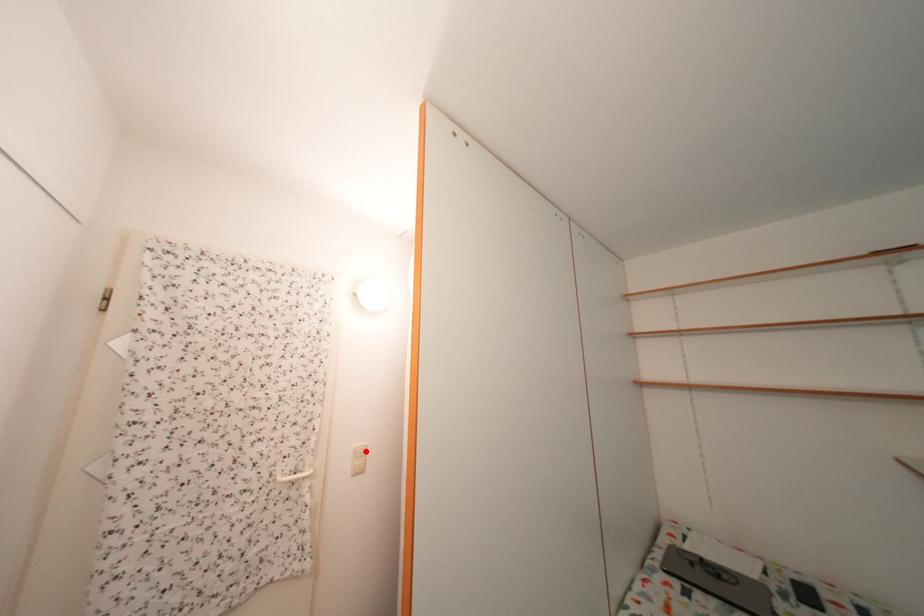
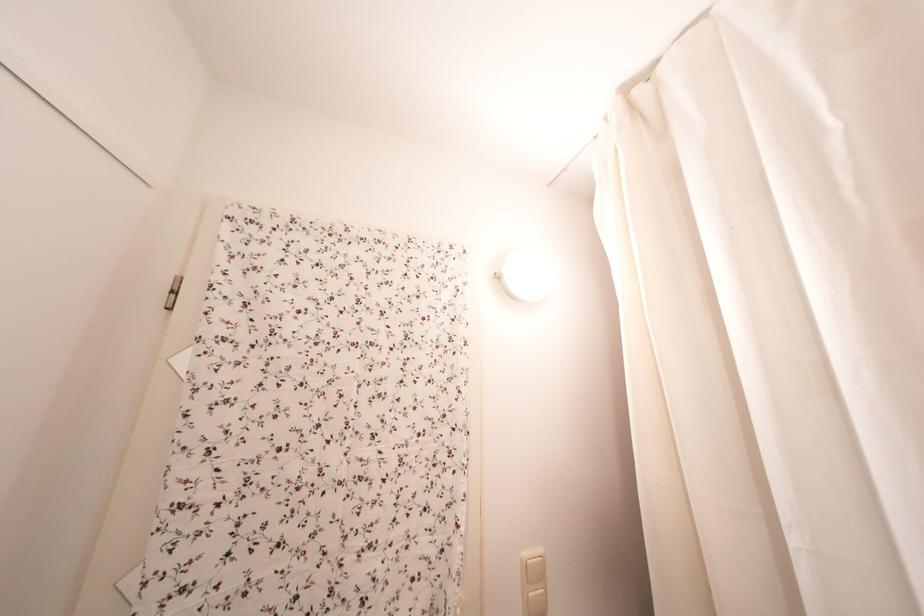
Find the pixel in the second image that matches the highlighted location in the first image.

(536, 560)